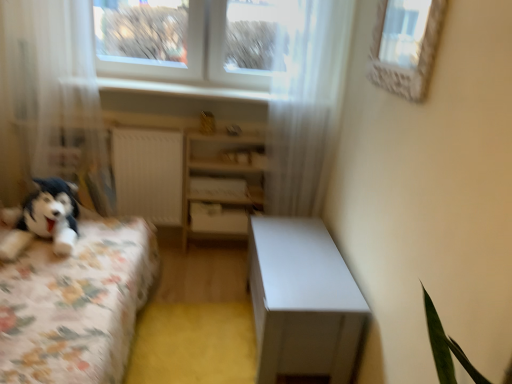
Question: Relative to white sheer curtain at left, which is the 1th curtain in left-to-right order, is white textured frame at upper right in front or behind?

Choices:
 (A) behind
 (B) front

Answer: (B)

Question: Does point (433, 52) appear closer or farther from the camera than point (27, 3)?

Choices:
 (A) closer
 (B) farther

Answer: (A)

Question: Estimate the real-world distances between objects in this image. Which object is closer to the white wood shelf at center?

Choices:
 (A) white textured frame at upper right
 (B) white sheer curtain at left, which is the 1th curtain in left-to-right order
 (C) white sheer curtain at upper center, which ranks as the second curtain in left-to-right order
 (D) white glossy table at center
 (E) white glossy window sill at upper center

Answer: (C)

Question: Which is nearer to the white glossy table at center?

Choices:
 (A) white wood shelf at center
 (B) white textured frame at upper right
 (C) white matte drawer at center
 (D) fluffy fabric bed at left
 (E) white sheer curtain at left, the 2th curtain when ordered from right to left

Answer: (A)